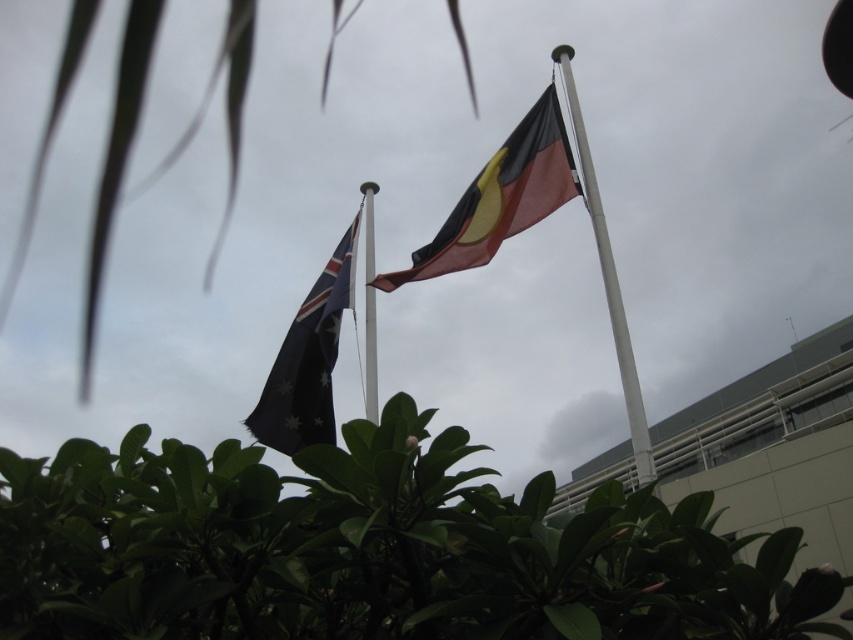
Question: Based on their relative distances, which object is nearer to the silver metallic pole at center?

Choices:
 (A) green leafy plant at center
 (B) green leafy plant at lower center
 (C) metallic flagpole at center
 (D) black and red fabric flag at center

Answer: (D)

Question: Can you confirm if green leafy plant at center is wider than black and red fabric flag at center?

Choices:
 (A) no
 (B) yes

Answer: (B)

Question: Is the position of green leafy plant at lower center more distant than that of green leafy plant at center?

Choices:
 (A) no
 (B) yes

Answer: (A)

Question: Which object is positioned closest to the dark blue fabric flag at center?

Choices:
 (A) green leafy plant at lower center
 (B) black and red fabric flag at center
 (C) green leafy plant at center
 (D) silver metallic pole at center

Answer: (B)

Question: Is green leafy plant at lower center above silver metallic pole at center?

Choices:
 (A) yes
 (B) no

Answer: (B)

Question: Which object is closer to the camera taking this photo?

Choices:
 (A) green leafy plant at lower center
 (B) dark blue fabric flag at center

Answer: (A)